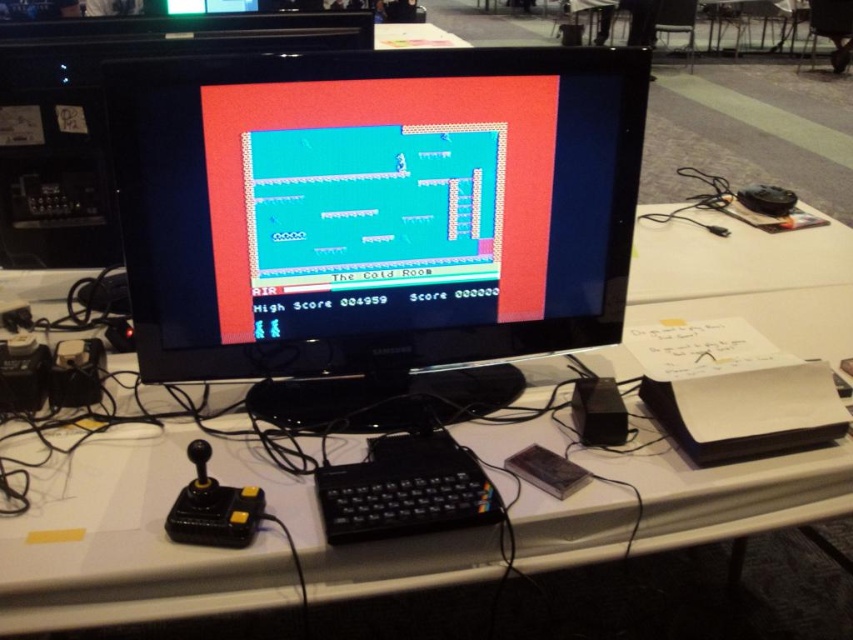
You are setting up a desk for a retro gaming setup. You have a black glossy monitor at center and a black plastic keyboard at center. Which object should you place first to ensure there is enough space for both?

The black glossy monitor at center is larger in size than the black plastic keyboard at center, so you should place the black glossy monitor at center first to ensure there is enough space for both.

You are setting up a gaming station and have a white plastic computer desk at center and a black plastic keyboard at center. Where should you place the keyboard relative to the desk?

The black plastic keyboard at center should be placed to the left of the white plastic computer desk at center since the desk is to the right of the keyboard.

You are a game developer analyzing the CRT monitor in the image. The monitor has a resolution of 1024x768 pixels. If the point at coordinates [374,220] is marked on the monitor, which object does this point correspond to?

The point at coordinates [374,220] corresponds to the black glossy monitor at center as specified in the Objects Description.